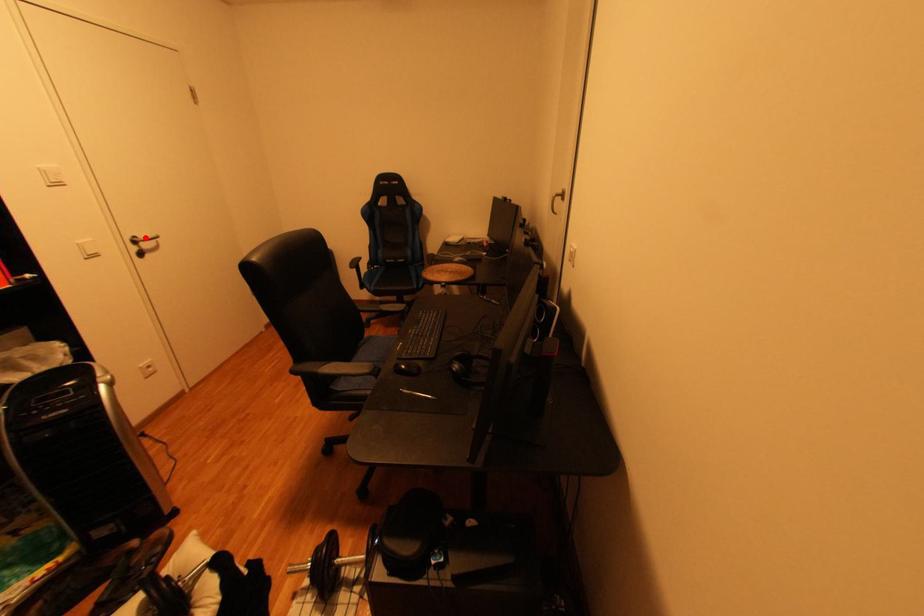
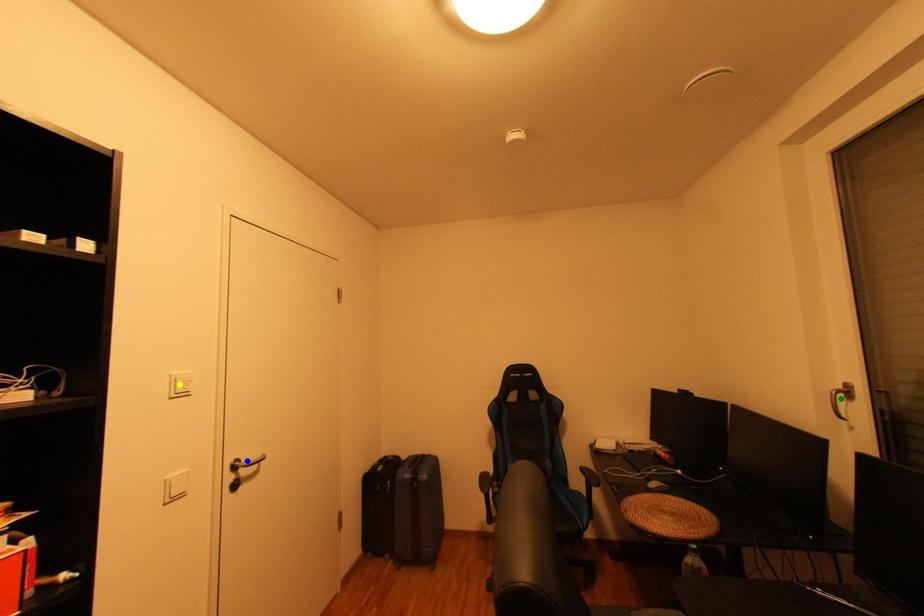
Question: I am providing you with two images of the same scene from different viewpoints. A red point is marked on the first image. You are given multiple points on the second image. In image 2, which mark is for the same physical point as the one in image 1?

Choices:
 (A) green point
 (B) yellow point
 (C) blue point

Answer: (C)